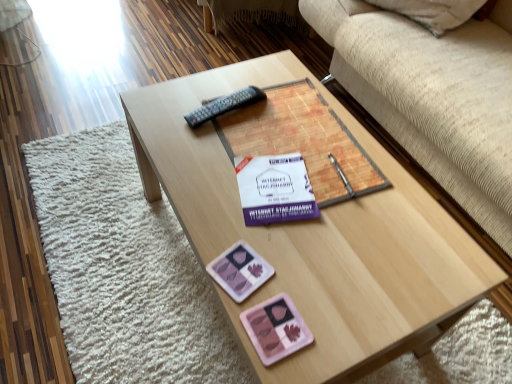
Image resolution: width=512 pixels, height=384 pixels. In order to click on vacant space that's between black plastic remote at center and matte paper book at center in this screenshot , I will do `click(211, 158)`.